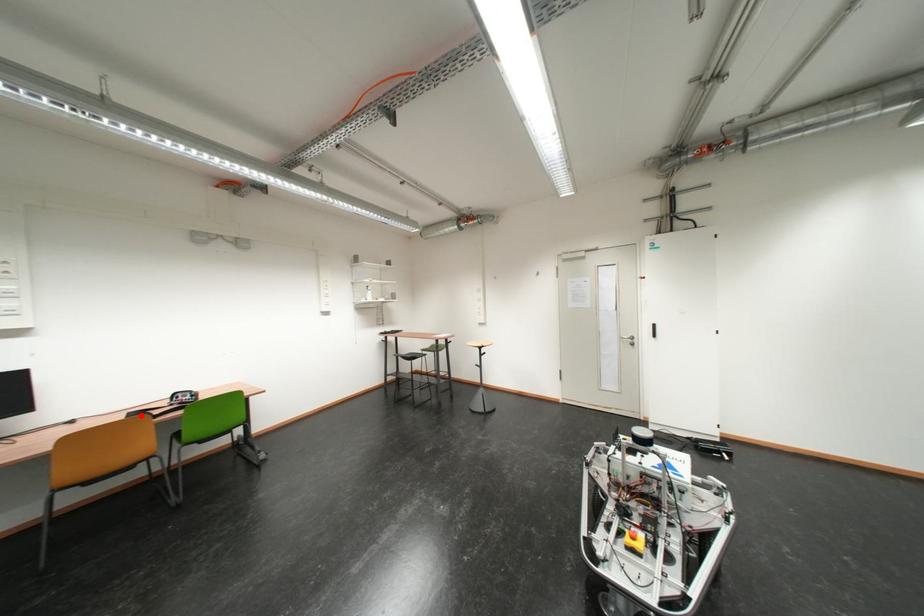
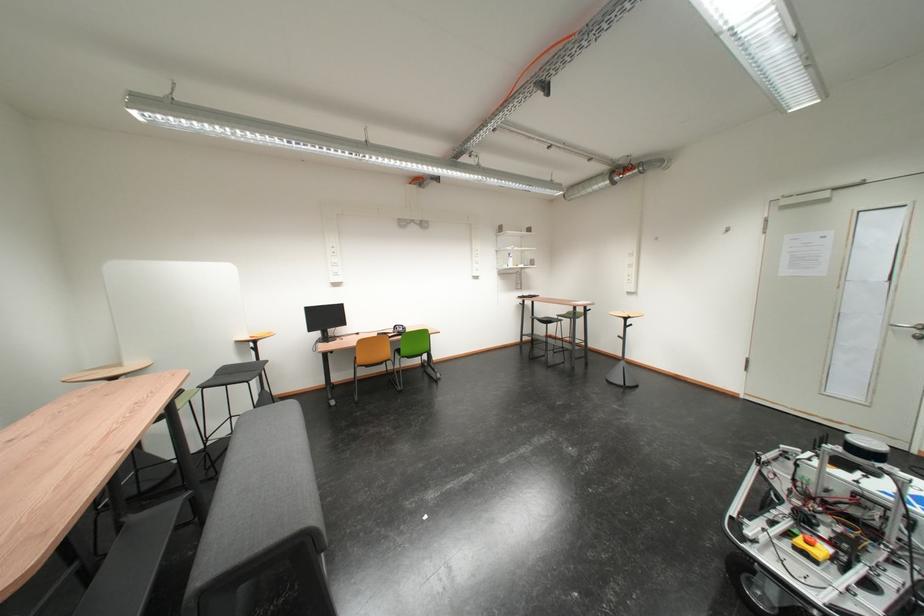
The point at the highlighted location is marked in the first image. Where is the corresponding point in the second image?

(390, 336)